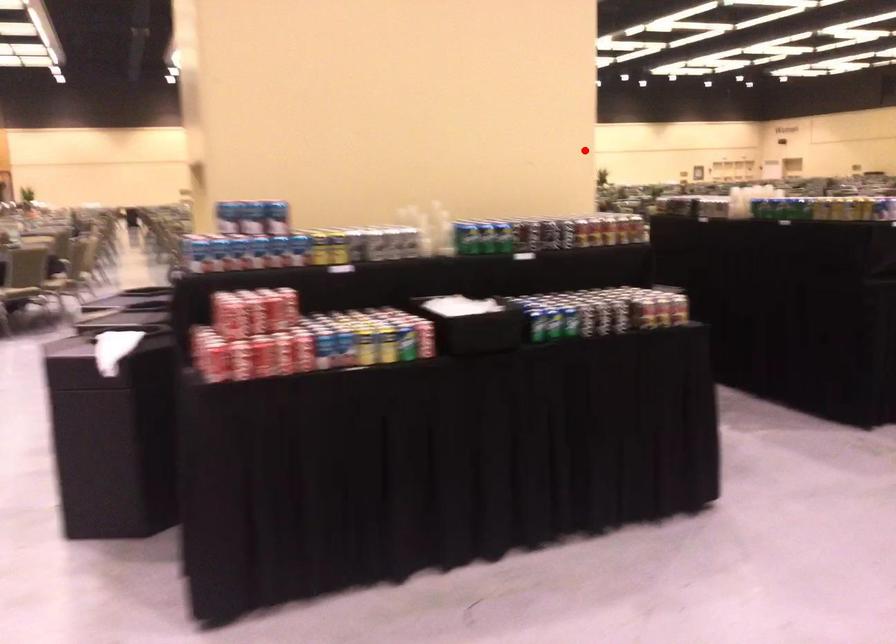
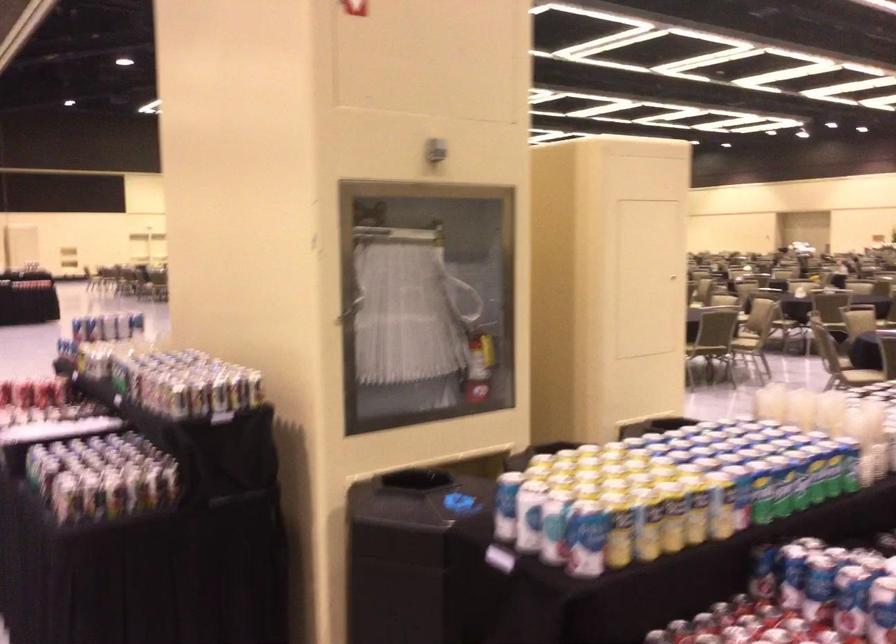
Locate, in the second image, the point that corresponds to the highlighted location in the first image.

(349, 310)